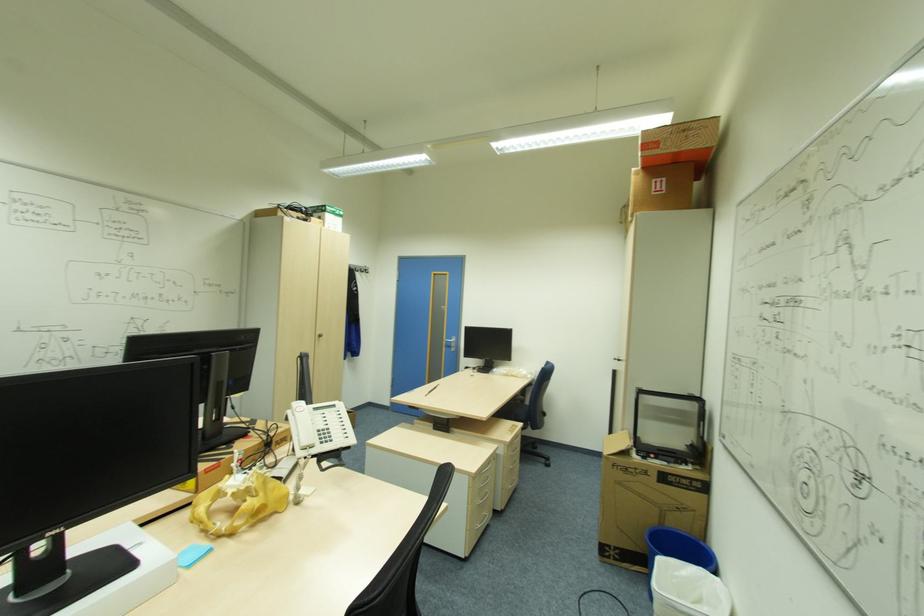
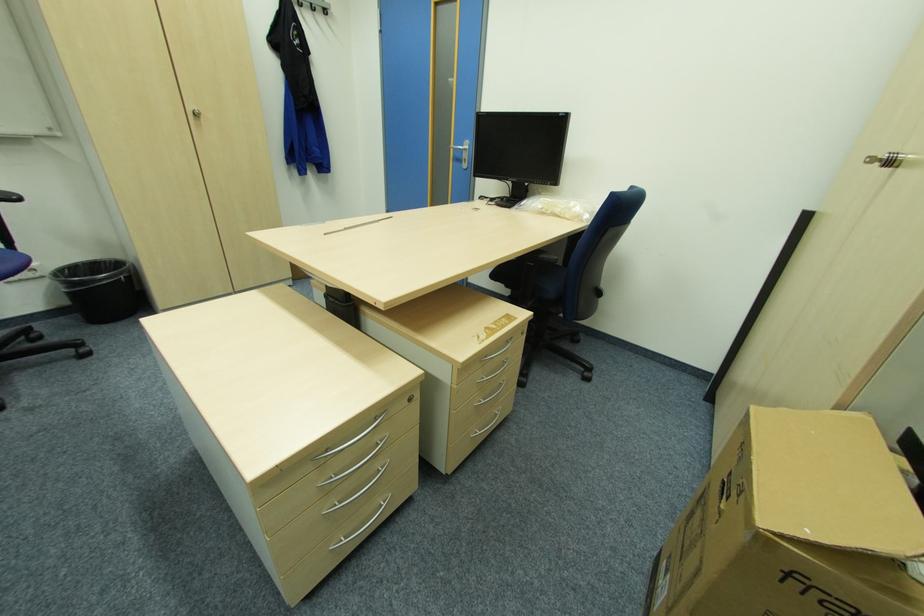
The point at (515,487) is marked in the first image. Where is the corresponding point in the second image?

(482, 432)